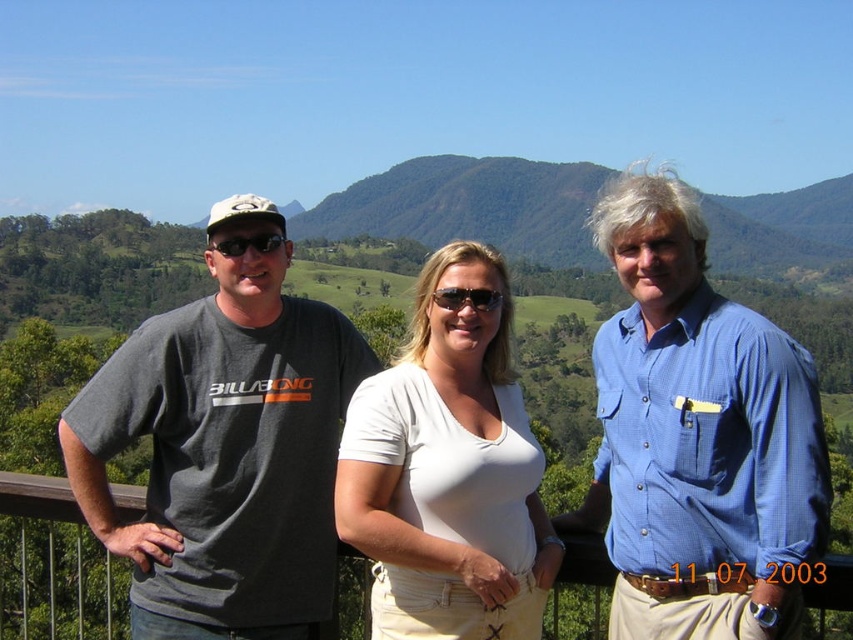
You are a photographer adjusting your camera settings to focus on the white cotton shirt at center. Given that your camera has a focal range of 0.5 to 0.6 meters, can you confirm if the shirt is within the focal range?

The white cotton shirt at center is located at point 0.739, which is beyond the camera focal range of 0.5 to 0.6 meters. Therefore, the shirt is out of focus.

You are a photographer trying to focus on the blue textured shirt at center and the black plastic sunglasses at center. Which object should you adjust your camera focus on first if you want to ensure both are in focus?

The blue textured shirt at center is closer to the viewer than the black plastic sunglasses at center, so you should focus on the blue textured shirt at center first to ensure both are in focus.